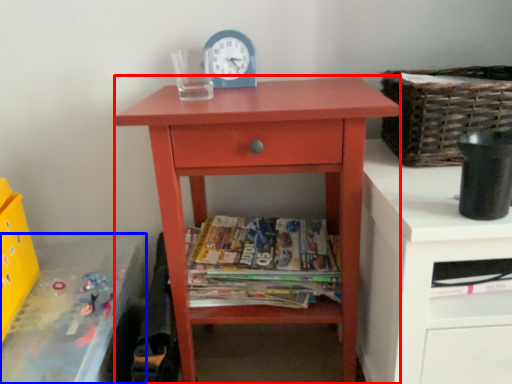
Question: Which point is closer to the camera, nightstand (highlighted by a red box) or changing table (highlighted by a blue box)?

Choices:
 (A) nightstand
 (B) changing table

Answer: (B)